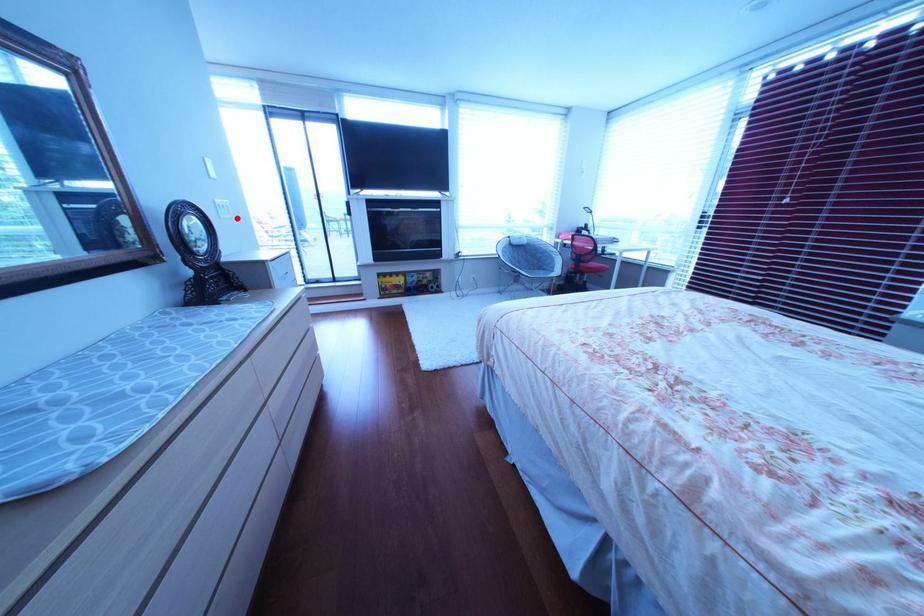
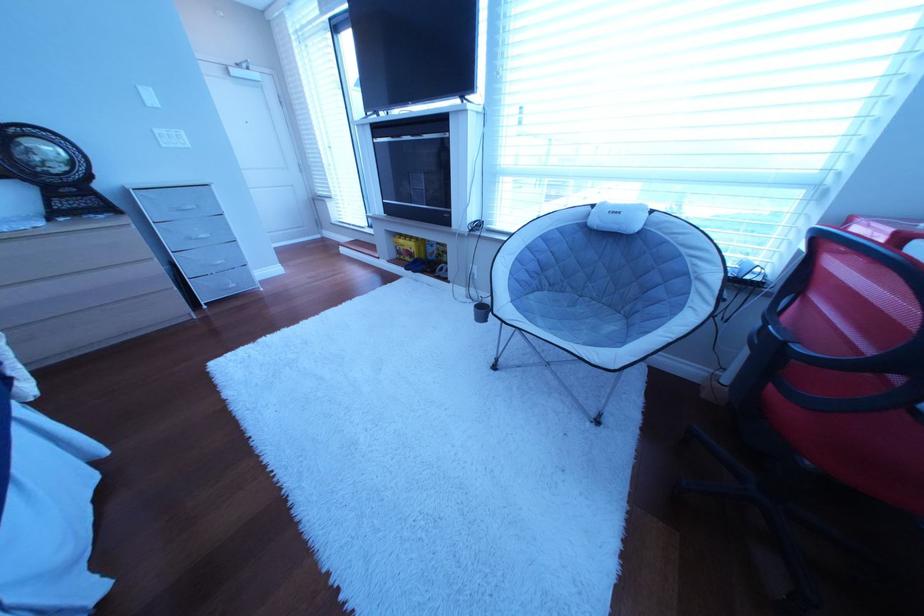
In the second image, find the point that corresponds to the highlighted location in the first image.

(179, 148)